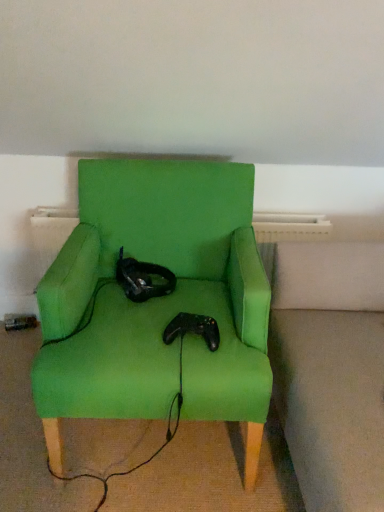
The height and width of the screenshot is (512, 384). Describe the element at coordinates (156, 302) in the screenshot. I see `green fabric chair at center` at that location.

Locate an element on the screen. This screenshot has height=512, width=384. green fabric chair at center is located at coordinates (156, 302).

Identify the location of green fabric chair at center. (156, 302).